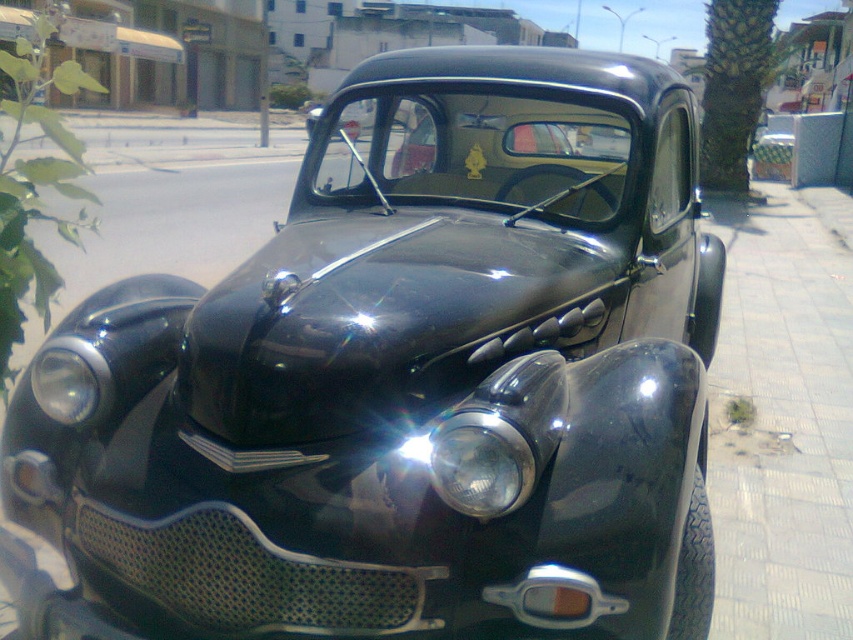
You are standing in the middle of the street facing the vintage car. There is a green leafy palm tree at right. Where is the green leafy palm tree relative to your position?

The green leafy palm tree at right is located at point 0.138 on the x axis and 0.860 on the y axis relative to your position.

You are a photographer trying to capture the matte black headlight at center and the green leafy palm tree at right in your shot. Which object will appear wider in the photo?

The green leafy palm tree at right will appear wider in the photo since its width is larger than the matte black headlight at center.